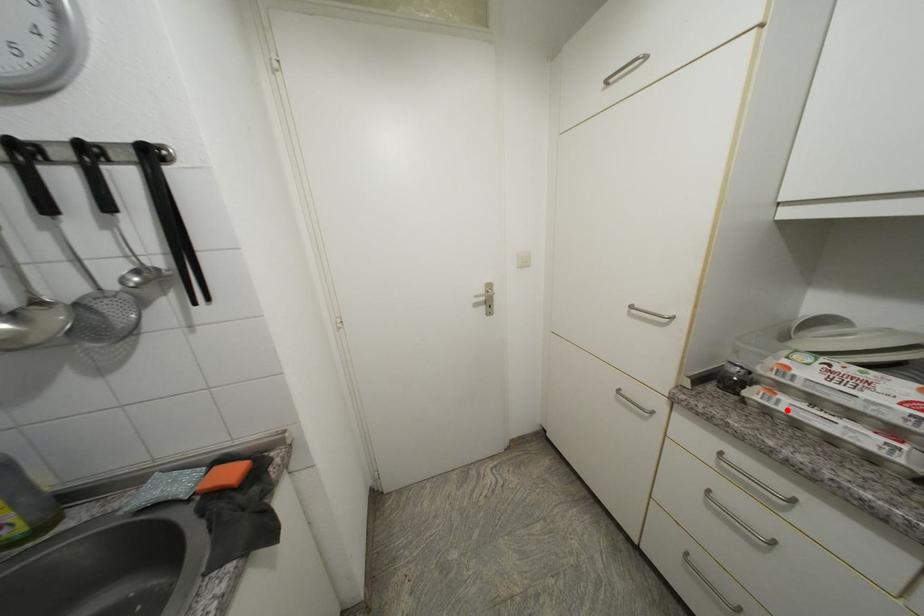
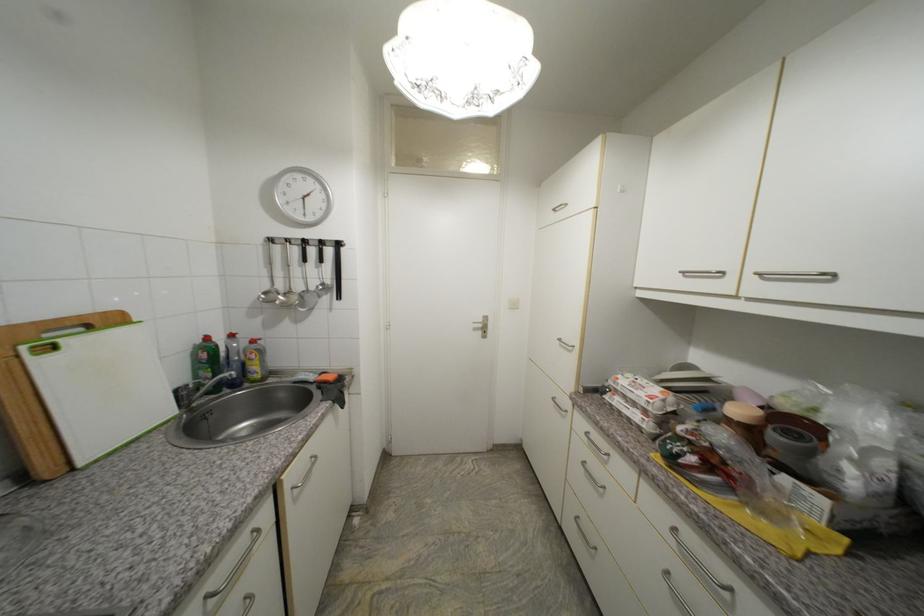
Locate, in the second image, the point that corresponds to the highlighted location in the first image.

(619, 405)